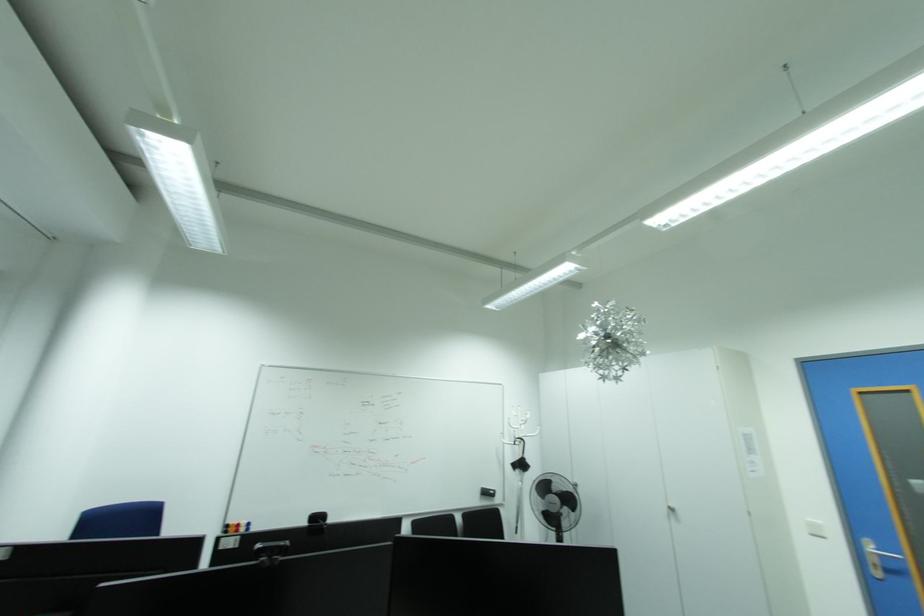
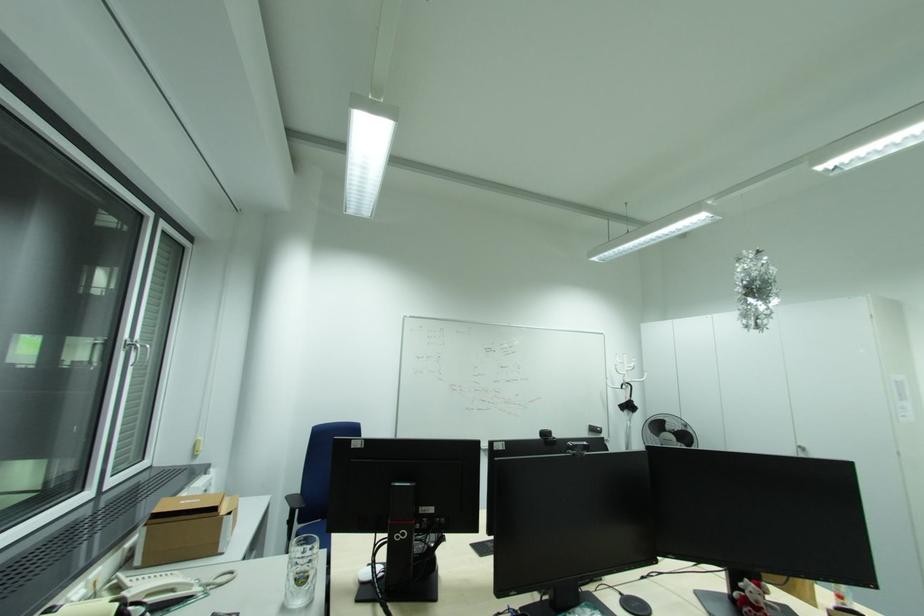
Question: The images are taken continuously from a first-person perspective. In which direction is your viewpoint rotating?

Choices:
 (A) Left
 (B) Right
 (C) Up
 (D) Down

Answer: (D)